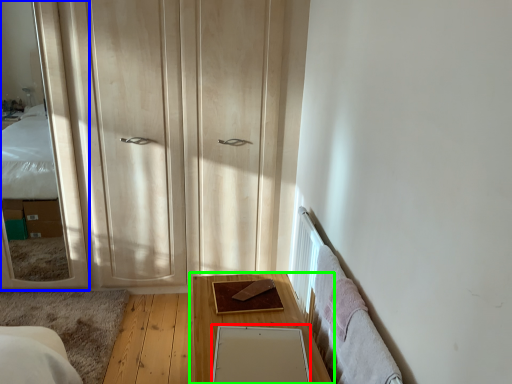
Question: Estimate the real-world distances between objects in this image. Which object is farther from mirror (highlighted by a red box), mirror (highlighted by a blue box) or table (highlighted by a green box)?

Choices:
 (A) mirror
 (B) table

Answer: (A)